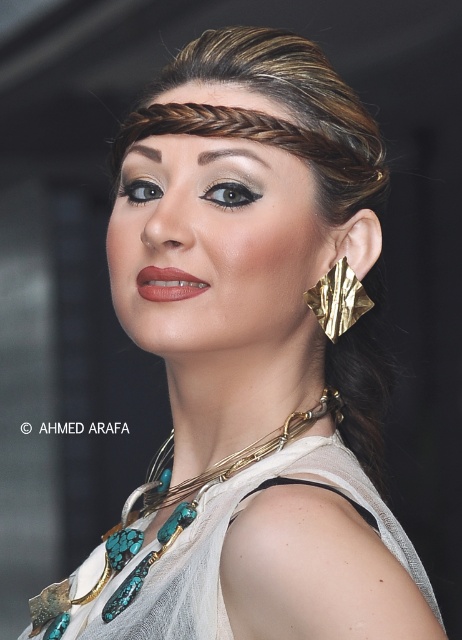
Is point (351, 321) in front of point (143, 285)?

No, (351, 321) is further to viewer.

Which is in front, point (322, 312) or point (178, 294)?

Point (178, 294)

Locate an element on the screen. gold textured leaf at ear is located at coordinates (338, 300).

This screenshot has height=640, width=462. Find the location of `turquoise/glass necklace at shoulder`. turquoise/glass necklace at shoulder is located at coordinates (231, 456).

This screenshot has height=640, width=462. In order to click on turquoise/glass necklace at shoulder in this screenshot , I will do `click(231, 456)`.

Where is `turquoise/glass necklace at shoulder`? The height and width of the screenshot is (640, 462). turquoise/glass necklace at shoulder is located at coordinates (231, 456).

Does turquoise/glass necklace at shoulder appear on the left side of matte pink lips at center?

No, turquoise/glass necklace at shoulder is not to the left of matte pink lips at center.

Consider the image. Does turquoise/glass necklace at shoulder have a smaller size compared to matte pink lips at center?

No, turquoise/glass necklace at shoulder is not smaller than matte pink lips at center.

The image size is (462, 640). I want to click on turquoise/glass necklace at shoulder, so click(231, 456).